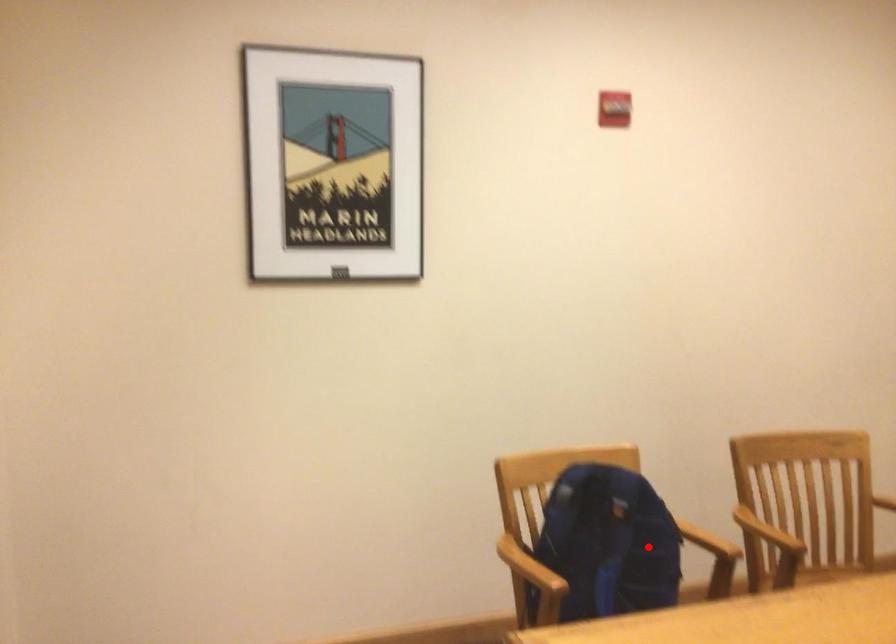
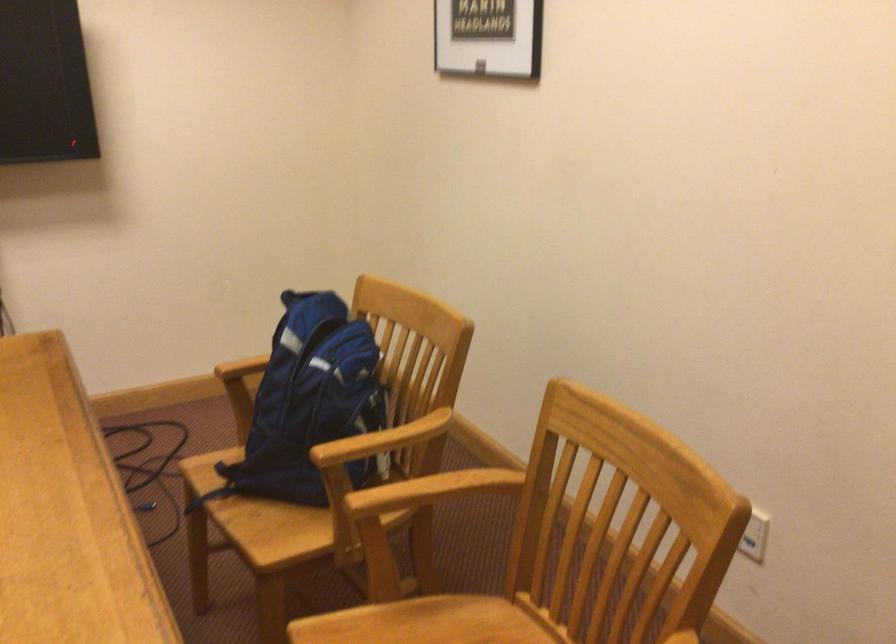
Where in the second image is the point corresponding to the highlighted location from the first image?

(309, 404)